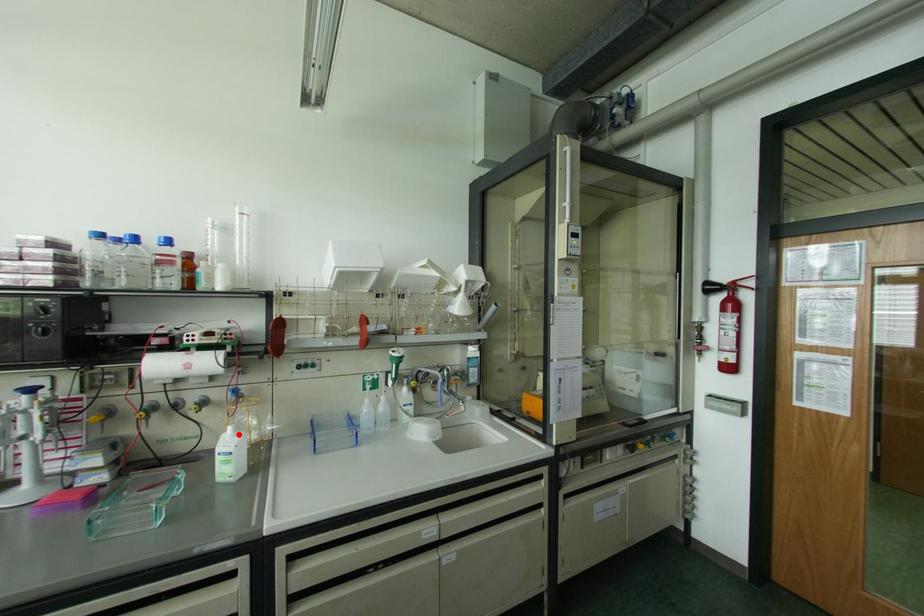
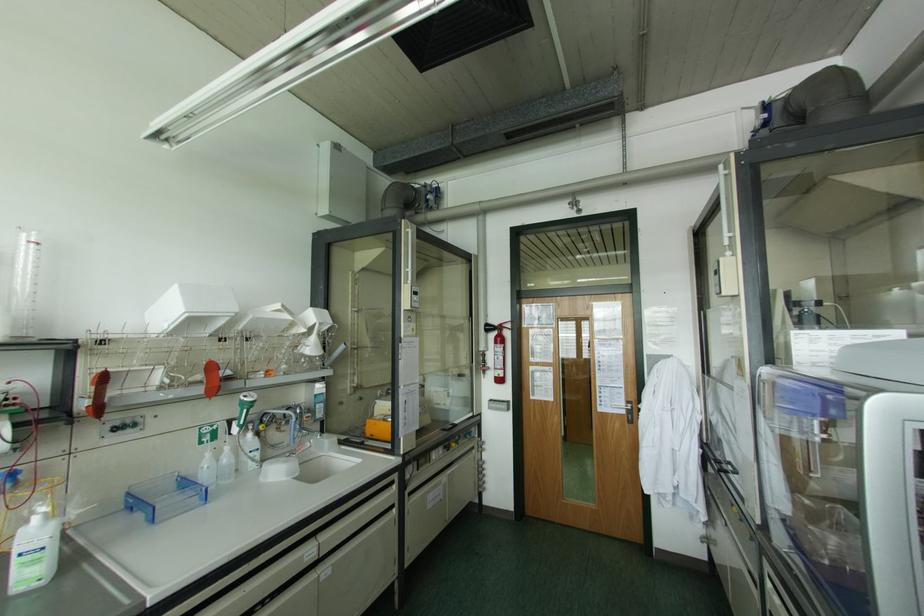
Question: I am providing you with two images of the same scene from different viewpoints. Given a red point in image1, look at the same physical point in image2. Is it:

Choices:
 (A) Closer to the viewpoint
 (B) Farther from the viewpoint

Answer: (A)